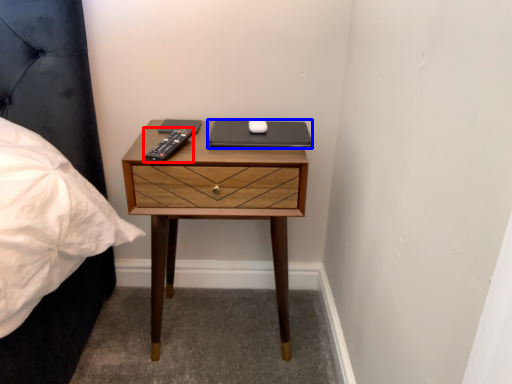
Question: Among these objects, which one is nearest to the camera, remote (highlighted by a red box) or laptop (highlighted by a blue box)?

Choices:
 (A) remote
 (B) laptop

Answer: (A)